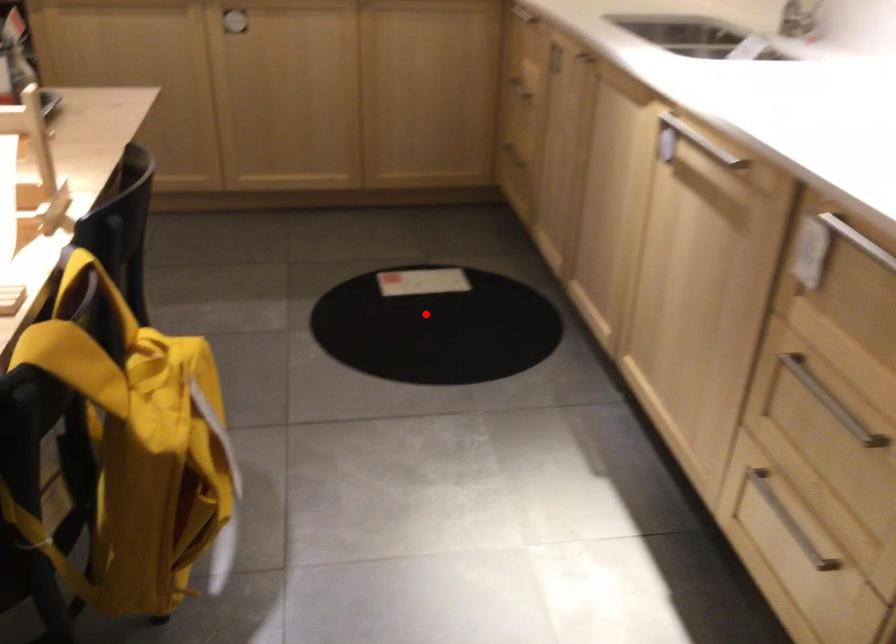
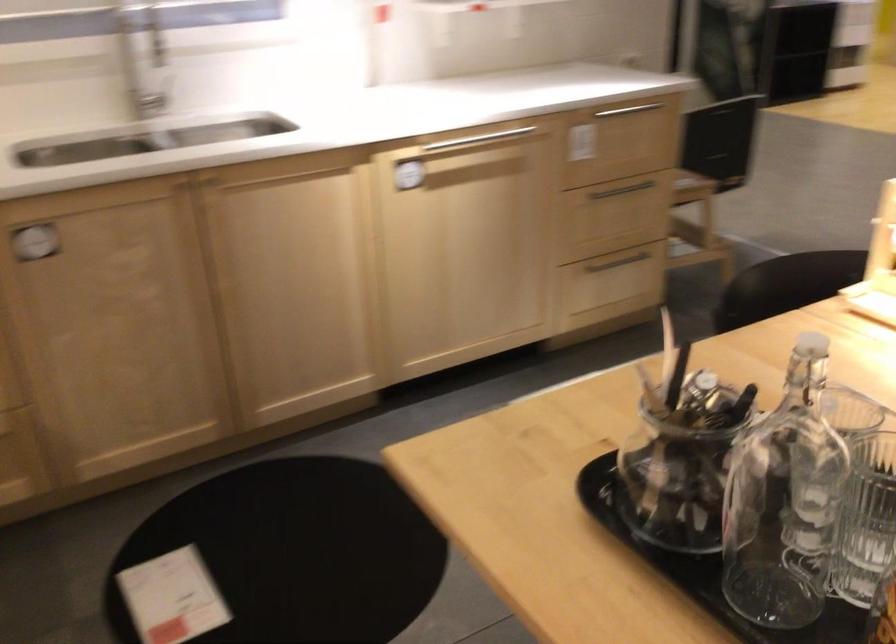
Find the pixel in the second image that matches the highlighted location in the first image.

(295, 553)